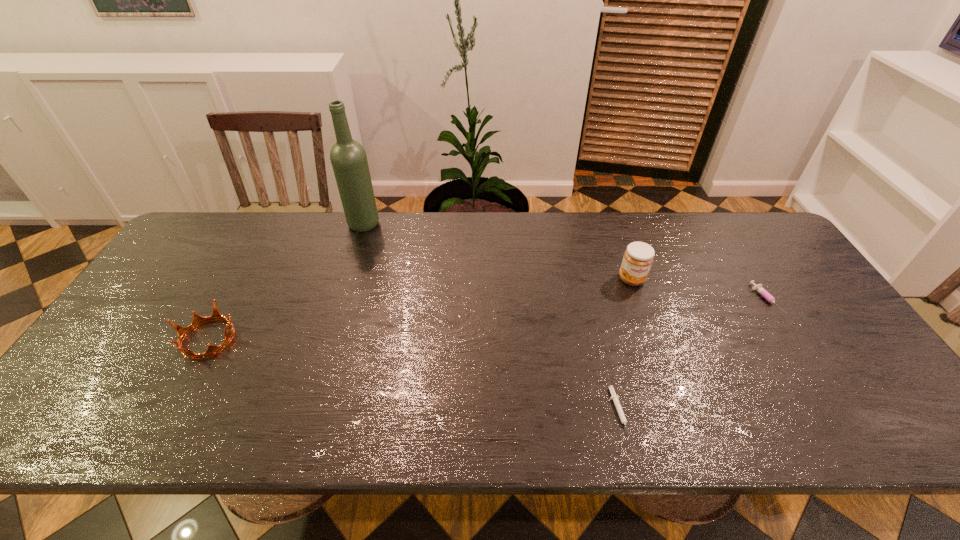
I want to click on vacant space that is in between the second tallest object and the nearest object, so click(625, 346).

Image resolution: width=960 pixels, height=540 pixels. I want to click on object that can be found as the third closest to the right syringe, so click(348, 157).

The width and height of the screenshot is (960, 540). What are the coordinates of `object that is the fourth closest one to the shortest object` in the screenshot? It's located at (197, 319).

Image resolution: width=960 pixels, height=540 pixels. Find the location of `vacant position in the image that satisfies the following two spatial constraints: 1. on the front side of the right syringe; 2. on the left side of the tallest object`. vacant position in the image that satisfies the following two spatial constraints: 1. on the front side of the right syringe; 2. on the left side of the tallest object is located at coordinates (340, 300).

Locate an element on the screen. The height and width of the screenshot is (540, 960). free point that satisfies the following two spatial constraints: 1. on the front side of the fourth tallest object; 2. on the right side of the farthest object is located at coordinates (340, 300).